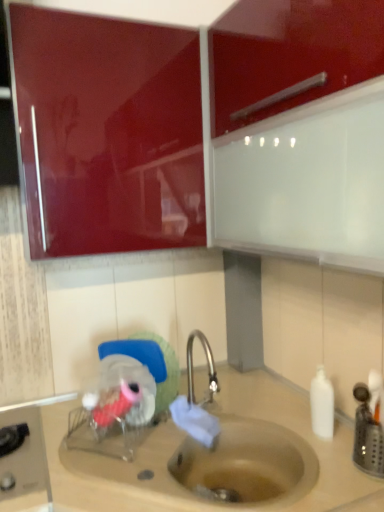
I want to click on free spot above beige matte sink at lower center (from a real-world perspective), so click(x=200, y=428).